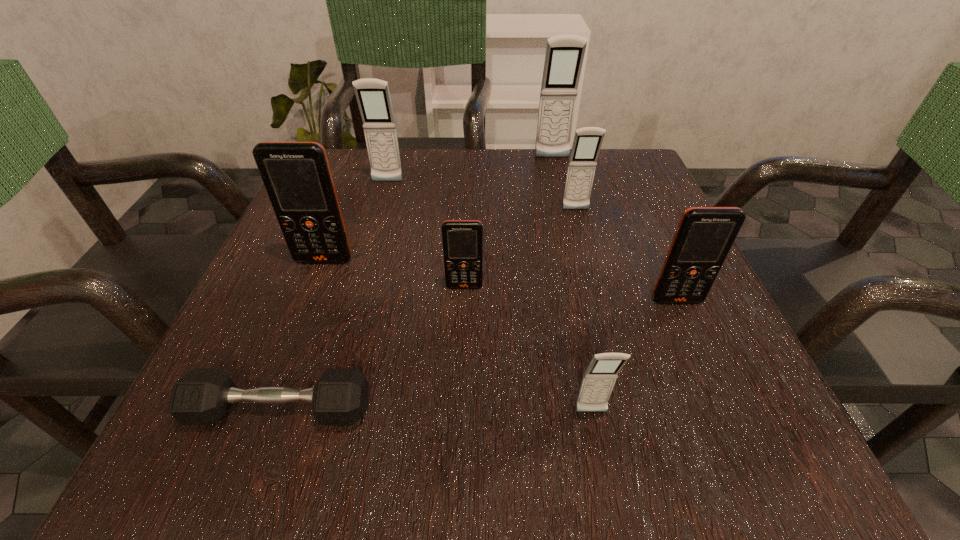
Locate an element on the screen. The image size is (960, 540). gray cellular telephone that is the closest to the third biggest gray cellular telephone is located at coordinates (564, 56).

In order to click on gray cellular telephone that is the second nearest to the farthest orange cellular telephone in this screenshot , I will do `click(587, 142)`.

The height and width of the screenshot is (540, 960). Identify the location of the second closest orange cellular telephone relative to the rightmost cellular telephone. (297, 177).

Identify which orange cellular telephone is the closest to the farthest gray cellular telephone. Please provide its 2D coordinates. Your answer should be formatted as a tuple, i.e. [(x, y)], where the tuple contains the x and y coordinates of a point satisfying the conditions above.

[(462, 240)]

The image size is (960, 540). Find the location of `vacant position in the image that satisfies the following two spatial constraints: 1. on the screen of the shortest object; 2. on the right side of the biggest orange cellular telephone`. vacant position in the image that satisfies the following two spatial constraints: 1. on the screen of the shortest object; 2. on the right side of the biggest orange cellular telephone is located at coordinates (268, 410).